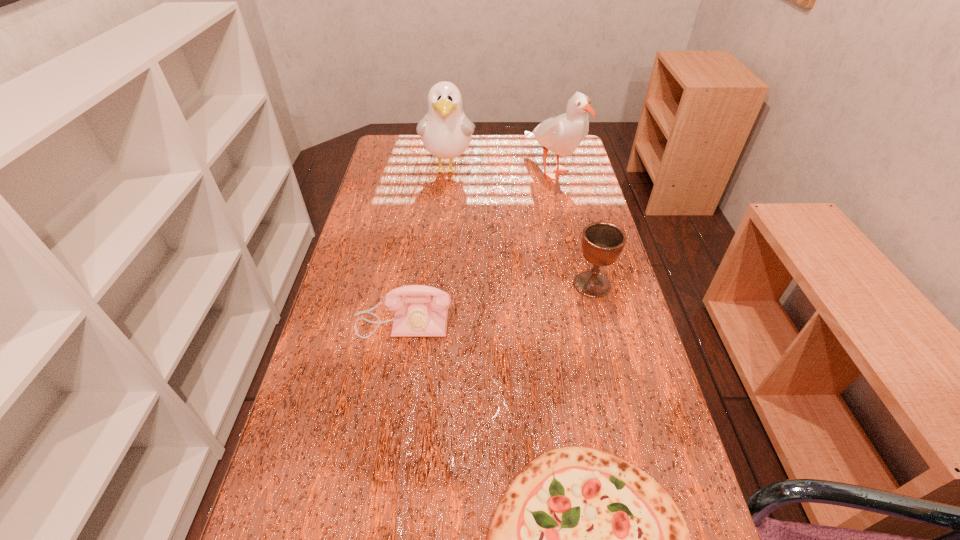
At what (x,y) coordinates should I click in order to perform the action: click on object at the left edge. Please return your answer as a coordinate pair (x, y). Looking at the image, I should click on (420, 310).

You are a GUI agent. You are given a task and a screenshot of the screen. Output one action in this format:
    pyautogui.click(x=<x>, y=<y>)
    Task: Click on the gull that is at the right edge
    
    Given the screenshot: What is the action you would take?
    pyautogui.click(x=562, y=134)

Identify the location of chalice present at the right edge. (602, 242).

Locate an element on the screen. object that is at the far right corner is located at coordinates (562, 134).

Image resolution: width=960 pixels, height=540 pixels. In order to click on vacant region at the far edge of the desktop in this screenshot , I will do `click(502, 147)`.

At what (x,y) coordinates should I click in order to perform the action: click on blank space at the left edge of the desktop. Please return your answer as a coordinate pair (x, y). Looking at the image, I should click on (354, 356).

You are a GUI agent. You are given a task and a screenshot of the screen. Output one action in this format:
    pyautogui.click(x=<x>, y=<y>)
    Task: Click on the vacant space at the right edge of the desktop
    
    Given the screenshot: What is the action you would take?
    pyautogui.click(x=552, y=237)

Image resolution: width=960 pixels, height=540 pixels. Find the location of `vacant area between the left gull and the right gull`. vacant area between the left gull and the right gull is located at coordinates (500, 168).

Locate an element on the screen. This screenshot has height=540, width=960. vacant region between the third tallest object and the right gull is located at coordinates (572, 227).

The width and height of the screenshot is (960, 540). In order to click on unoccupied area between the chalice and the left gull in this screenshot , I will do `click(520, 226)`.